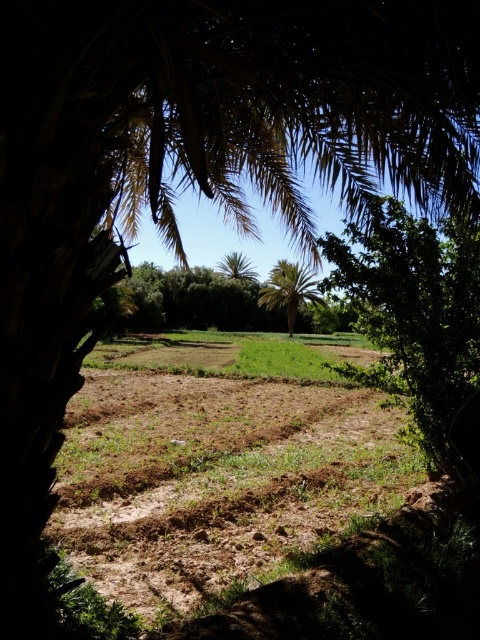
Is brown soil at center shorter than green leafy tree at center?

Incorrect, brown soil at center's height does not fall short of green leafy tree at center's.

Does point (151, 616) come in front of point (446, 236)?

Yes, point (151, 616) is closer to viewer.

The image size is (480, 640). Identify the location of brown soil at center. (214, 472).

Does brown soil at center have a lesser width compared to green leafy palm tree at center?

Incorrect, brown soil at center's width is not less than green leafy palm tree at center's.

This screenshot has height=640, width=480. Describe the element at coordinates (214, 472) in the screenshot. I see `brown soil at center` at that location.

Where is `brown soil at center`? brown soil at center is located at coordinates (214, 472).

Based on the photo, does green leafy tree at center appear on the right side of green leafy palm at center?

In fact, green leafy tree at center is to the left of green leafy palm at center.

Does point (435, 362) come in front of point (305, 280)?

Yes, point (435, 362) is closer to viewer.

This screenshot has height=640, width=480. I want to click on green leafy tree at center, so click(411, 312).